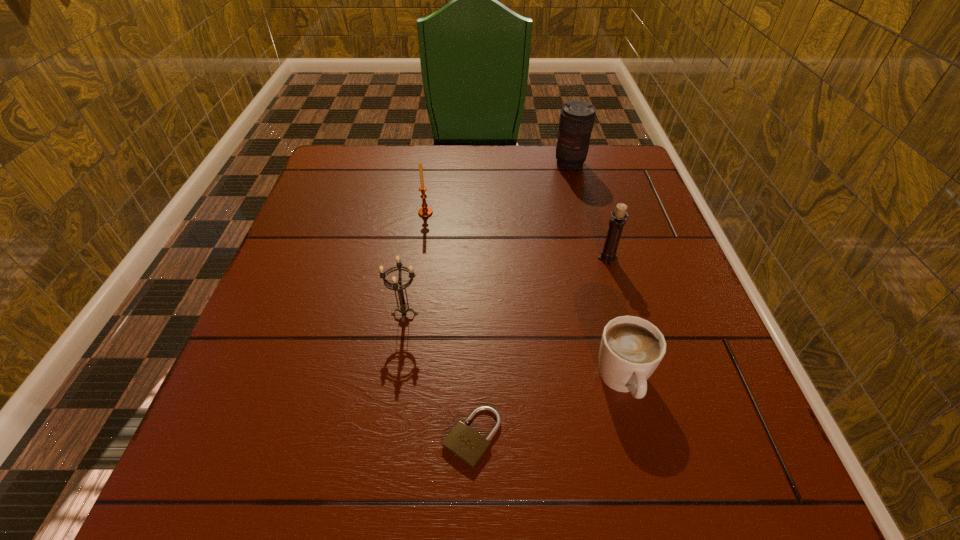
The height and width of the screenshot is (540, 960). I want to click on the farthest object, so click(x=577, y=117).

This screenshot has height=540, width=960. In order to click on the second farthest candle holder in this screenshot , I will do `click(617, 222)`.

Locate an element on the screen. The width and height of the screenshot is (960, 540). the fourth nearest object is located at coordinates (617, 222).

You are a GUI agent. You are given a task and a screenshot of the screen. Output one action in this format:
    pyautogui.click(x=<x>, y=<y>)
    Task: Click on the farthest candle holder
    The image size is (960, 540).
    Given the screenshot: What is the action you would take?
    point(425,211)

Locate an element on the screen. This screenshot has height=540, width=960. the nearest candle holder is located at coordinates 403,308.

Locate an element on the screen. Image resolution: width=960 pixels, height=540 pixels. cappuccino is located at coordinates (631, 348).

Find the location of a particular element. The image size is (960, 540). the third object from left to right is located at coordinates (467, 445).

I want to click on the shortest object, so click(x=467, y=445).

Identify the location of free space located 0.180m on the side of the telephoto lens where the control switches are located. This screenshot has width=960, height=540. (583, 213).

At what (x,y) coordinates should I click in order to perform the action: click on vacant space located 0.330m on the back of the second nearest candle holder. Please return your answer as a coordinate pair (x, y). The height and width of the screenshot is (540, 960). Looking at the image, I should click on (583, 171).